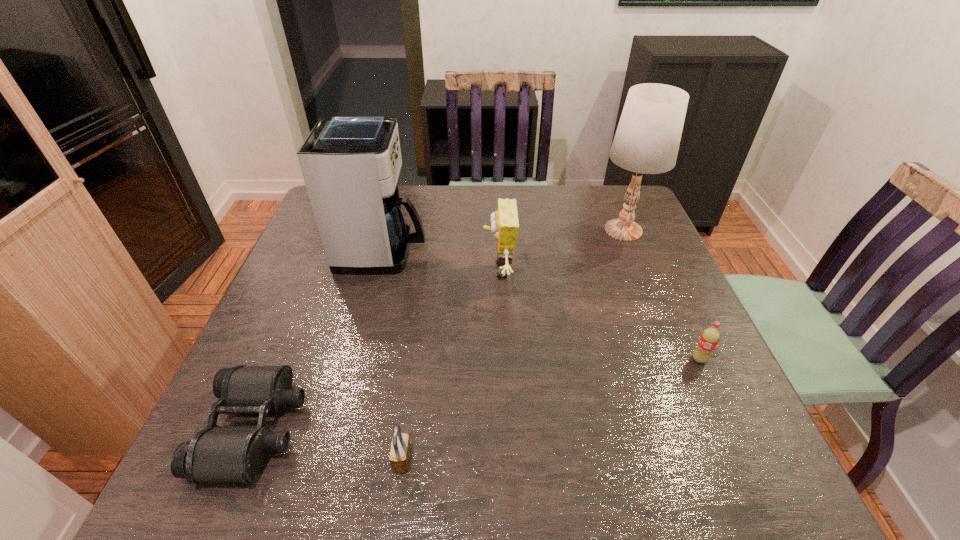
What are the coordinates of `vacant space that's between the shortest object and the coffee maker` in the screenshot? It's located at (319, 340).

Where is `free space that is in between the shortest object and the padlock`? free space that is in between the shortest object and the padlock is located at coordinates (328, 444).

You are a GUI agent. You are given a task and a screenshot of the screen. Output one action in this format:
    pyautogui.click(x=<x>, y=<y>)
    Task: Click on the free space between the shortest object and the padlock
    
    Given the screenshot: What is the action you would take?
    pyautogui.click(x=328, y=444)

At what (x,y) coordinates should I click in order to perform the action: click on free space between the sponge and the coffee maker. Please return your answer as a coordinate pair (x, y). The height and width of the screenshot is (540, 960). Looking at the image, I should click on (441, 261).

I want to click on free point between the third nearest object and the shortest object, so click(477, 394).

I want to click on empty space between the fourth shortest object and the fourth farthest object, so click(599, 315).

You are a GUI agent. You are given a task and a screenshot of the screen. Output one action in this format:
    pyautogui.click(x=<x>, y=<y>)
    Task: Click on the free space between the third object from right to left and the shortest object
    The width and height of the screenshot is (960, 540).
    Given the screenshot: What is the action you would take?
    pyautogui.click(x=376, y=350)

This screenshot has width=960, height=540. I want to click on object that is the second nearest to the shortest object, so click(x=350, y=164).

Find the location of a particular element. This screenshot has height=540, width=960. object that is the second closest to the coffee maker is located at coordinates (217, 453).

This screenshot has height=540, width=960. Find the location of `blank area in the image that satisfies the following two spatial constraints: 1. on the face of the sponge; 2. on the back side of the soda`. blank area in the image that satisfies the following two spatial constraints: 1. on the face of the sponge; 2. on the back side of the soda is located at coordinates (503, 359).